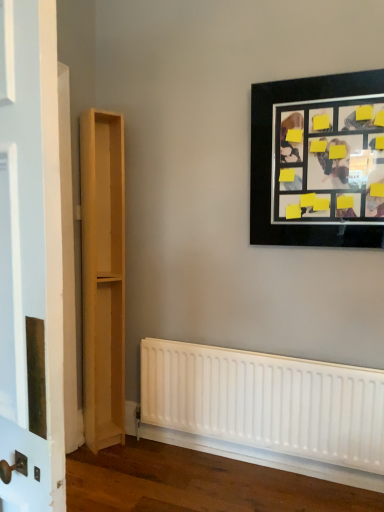
Find the location of a particular element. Image resolution: width=384 pixels, height=512 pixels. black matte picture frame at upper right is located at coordinates (318, 161).

This screenshot has height=512, width=384. Describe the element at coordinates (265, 403) in the screenshot. I see `white matte radiator at lower center` at that location.

You are a GUI agent. You are given a task and a screenshot of the screen. Output one action in this format:
    pyautogui.click(x=<x>, y=<y>)
    Task: Click on the black matte picture frame at upper right
    The width and height of the screenshot is (384, 512).
    Given the screenshot: What is the action you would take?
    pyautogui.click(x=318, y=161)

Which object is closer to the camera taking this photo, white matte radiator at lower center or light wood bookshelf at left?

Positioned in front is white matte radiator at lower center.

From a real-world perspective, is white matte radiator at lower center positioned under light wood bookshelf at left based on gravity?

Yes, from a real-world perspective, white matte radiator at lower center is below light wood bookshelf at left.

From the image's perspective, relative to light wood bookshelf at left, is white matte radiator at lower center above or below?

Based on their image positions, white matte radiator at lower center is located beneath light wood bookshelf at left.

Which is more to the left, white matte radiator at lower center or black matte picture frame at upper right?

Positioned to the left is white matte radiator at lower center.

In terms of height, does white matte radiator at lower center look taller or shorter compared to black matte picture frame at upper right?

white matte radiator at lower center is shorter than black matte picture frame at upper right.

Looking at the image, does white matte radiator at lower center seem bigger or smaller compared to black matte picture frame at upper right?

white matte radiator at lower center is smaller than black matte picture frame at upper right.

Is there a large distance between light wood bookshelf at left and black matte picture frame at upper right?

Yes, light wood bookshelf at left and black matte picture frame at upper right are quite far apart.

Considering the relative sizes of light wood bookshelf at left and black matte picture frame at upper right in the image provided, is light wood bookshelf at left smaller than black matte picture frame at upper right?

Incorrect, light wood bookshelf at left is not smaller in size than black matte picture frame at upper right.

How far apart are light wood bookshelf at left and black matte picture frame at upper right?

light wood bookshelf at left and black matte picture frame at upper right are 3.79 feet apart from each other.

From a real-world perspective, is light wood bookshelf at left physically located above or below black matte picture frame at upper right?

From a real-world perspective, light wood bookshelf at left is physically below black matte picture frame at upper right.

Can you confirm if black matte picture frame at upper right is smaller than light wood bookshelf at left?

Yes, black matte picture frame at upper right is smaller than light wood bookshelf at left.

What's the angular difference between black matte picture frame at upper right and light wood bookshelf at left's facing directions?

The angular difference between black matte picture frame at upper right and light wood bookshelf at left is 58.9 degrees.

From the image's perspective, which one is positioned lower, black matte picture frame at upper right or light wood bookshelf at left?

light wood bookshelf at left, from the image's perspective.

Is black matte picture frame at upper right facing towards light wood bookshelf at left?

No, black matte picture frame at upper right is not aimed at light wood bookshelf at left.

Is black matte picture frame at upper right facing away from white matte radiator at lower center?

No, black matte picture frame at upper right is not facing the opposite direction of white matte radiator at lower center.

Based on their sizes in the image, would you say black matte picture frame at upper right is bigger or smaller than white matte radiator at lower center?

black matte picture frame at upper right is bigger than white matte radiator at lower center.

Is light wood bookshelf at left oriented towards white matte radiator at lower center?

No, light wood bookshelf at left is not turned towards white matte radiator at lower center.

Is light wood bookshelf at left positioned in front of white matte radiator at lower center?

That is False.

Is light wood bookshelf at left far away from white matte radiator at lower center?

No, there isn't a large distance between light wood bookshelf at left and white matte radiator at lower center.

From the image's perspective, relative to white matte radiator at lower center, is light wood bookshelf at left above or below?

light wood bookshelf at left is situated higher than white matte radiator at lower center in the image.

I want to click on radiator lying below the light wood bookshelf at left (from the image's perspective), so click(x=265, y=403).

Where is `picture frame lying on the right of white matte radiator at lower center`? Image resolution: width=384 pixels, height=512 pixels. picture frame lying on the right of white matte radiator at lower center is located at coordinates (318, 161).

Looking at the image, which one is located further to black matte picture frame at upper right, light wood bookshelf at left or white matte radiator at lower center?

light wood bookshelf at left.

Estimate the real-world distances between objects in this image. Which object is closer to white matte radiator at lower center, light wood bookshelf at left or black matte picture frame at upper right?

light wood bookshelf at left lies closer to white matte radiator at lower center than the other object.

From the image, which object appears to be nearer to black matte picture frame at upper right, white matte radiator at lower center or light wood bookshelf at left?

white matte radiator at lower center is closer to black matte picture frame at upper right.

When comparing their distances from light wood bookshelf at left, does black matte picture frame at upper right or white matte radiator at lower center seem closer?

white matte radiator at lower center is positioned closer to the anchor light wood bookshelf at left.

Looking at the image, which one is located closer to white matte radiator at lower center, black matte picture frame at upper right or light wood bookshelf at left?

Based on the image, light wood bookshelf at left appears to be nearer to white matte radiator at lower center.

Considering their positions, is white matte radiator at lower center positioned further to light wood bookshelf at left than black matte picture frame at upper right?

Among the two, black matte picture frame at upper right is located further to light wood bookshelf at left.

At what (x,y) coordinates should I click in order to perform the action: click on bookshelf that lies between black matte picture frame at upper right and white matte radiator at lower center from top to bottom. Please return your answer as a coordinate pair (x, y). The height and width of the screenshot is (512, 384). Looking at the image, I should click on (103, 277).